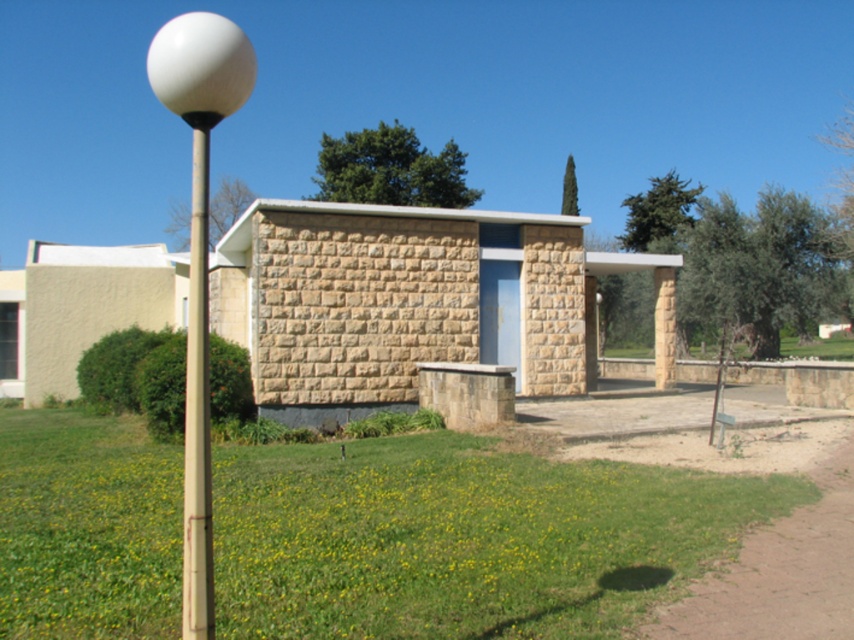
You are standing in front of the modern building and notice the green grass at lower center and the white glossy ball at left. Which object is positioned lower in the image?

The green grass at lower center is positioned lower than the white glossy ball at left.

From the picture: You are a maintenance worker needing to reach the white glossy ball at left from the brown stone shelter at center. Given that your ladder is 10 meters long, will it be sufficient to reach the ball?

The brown stone shelter at center is 9.84 meters from the white glossy ball at left. Since the ladder is 10 meters long, it is just long enough to reach the ball from the shelter.

From the picture: You are a gardener planning to plant a row of flowers between the green grass at lower center and the brown stone shelter at center. Considering the space available, which area would you choose to ensure the flowers have enough room to grow?

The brown stone shelter at center has more space since the green grass at lower center is thinner, meaning it has less area available for planting.